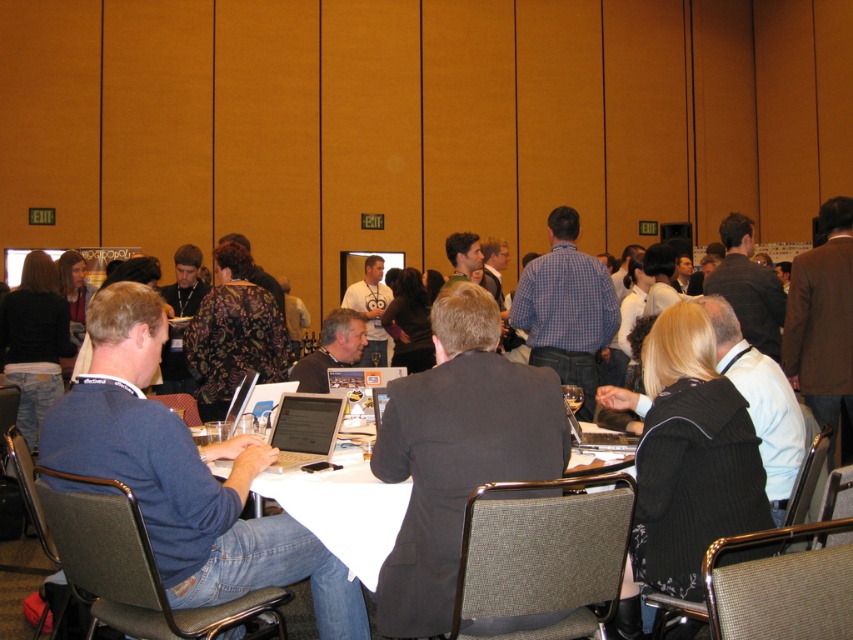
Question: Which object appears closest to the camera in this image?

Choices:
 (A) blue fabric shirt at left
 (B) gray fabric chair at center

Answer: (B)

Question: Which point is farther to the camera?

Choices:
 (A) dark gray fabric chair at lower left
 (B) white t-shirt at center

Answer: (B)

Question: Which object appears farthest from the camera in this image?

Choices:
 (A) metallic mesh chair at center
 (B) dark gray suit at center
 (C) gray fabric chair at center

Answer: (B)

Question: Does dark brown suit at upper right have a smaller size compared to white t-shirt at center?

Choices:
 (A) no
 (B) yes

Answer: (B)

Question: Is the position of brown woolen jacket at right more distant than that of light brown leather jacket at lower right?

Choices:
 (A) yes
 (B) no

Answer: (A)

Question: Is gray fabric chair at lower left below black mesh chair at lower right?

Choices:
 (A) yes
 (B) no

Answer: (A)